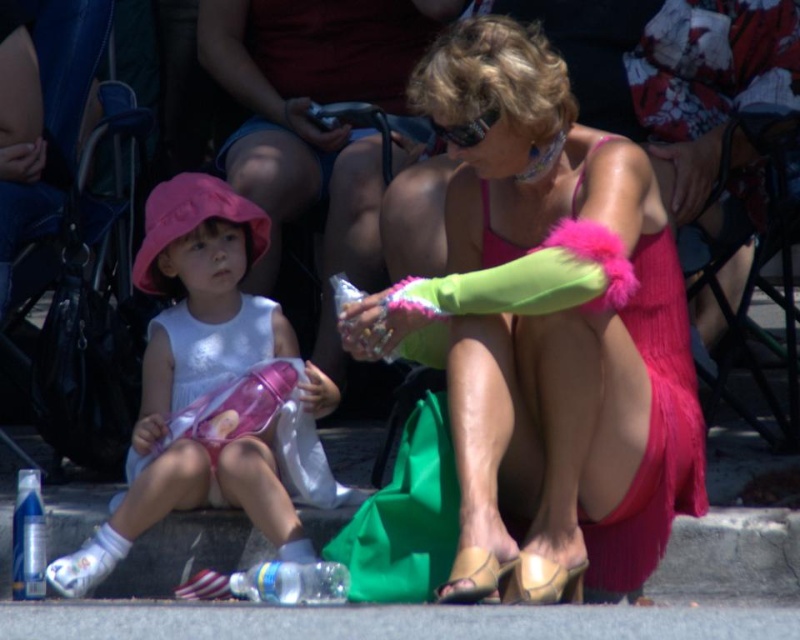
Which is below, pink fuzzy arm at center or blue plastic bottle at lower left?

blue plastic bottle at lower left

Is point (644, 244) behind point (30, 566)?

No.

I want to click on pink fuzzy arm at center, so click(x=550, y=317).

Who is more forward, [644,538] or [472,132]?

Point [472,132] is in front.

Can you confirm if pink fuzzy arm at center is bigger than sunglasses at center?

Indeed, pink fuzzy arm at center has a larger size compared to sunglasses at center.

What do you see at coordinates (550, 317) in the screenshot? The image size is (800, 640). I see `pink fuzzy arm at center` at bounding box center [550, 317].

You are a GUI agent. You are given a task and a screenshot of the screen. Output one action in this format:
    pyautogui.click(x=<x>, y=<y>)
    Task: Click on the pink fuzzy arm at center
    
    Given the screenshot: What is the action you would take?
    pyautogui.click(x=550, y=317)

Is point (29, 524) closer to viewer compared to point (508, 568)?

No.

Does blue plastic bottle at lower left have a greater width compared to matte gold sandal at lower center?

Incorrect, blue plastic bottle at lower left's width does not surpass matte gold sandal at lower center's.

This screenshot has width=800, height=640. What do you see at coordinates (28, 538) in the screenshot?
I see `blue plastic bottle at lower left` at bounding box center [28, 538].

Locate an element on the screen. This screenshot has height=640, width=800. blue plastic bottle at lower left is located at coordinates (28, 538).